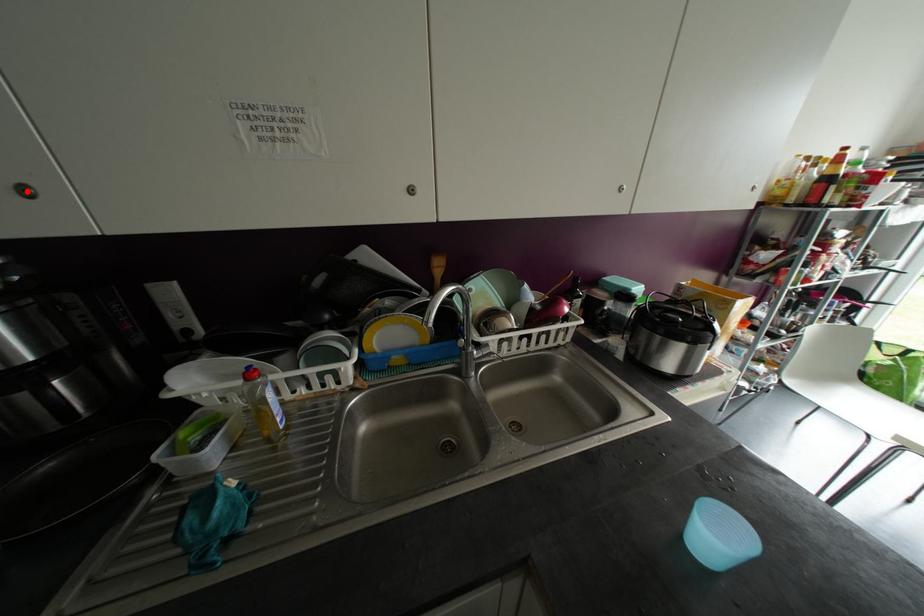
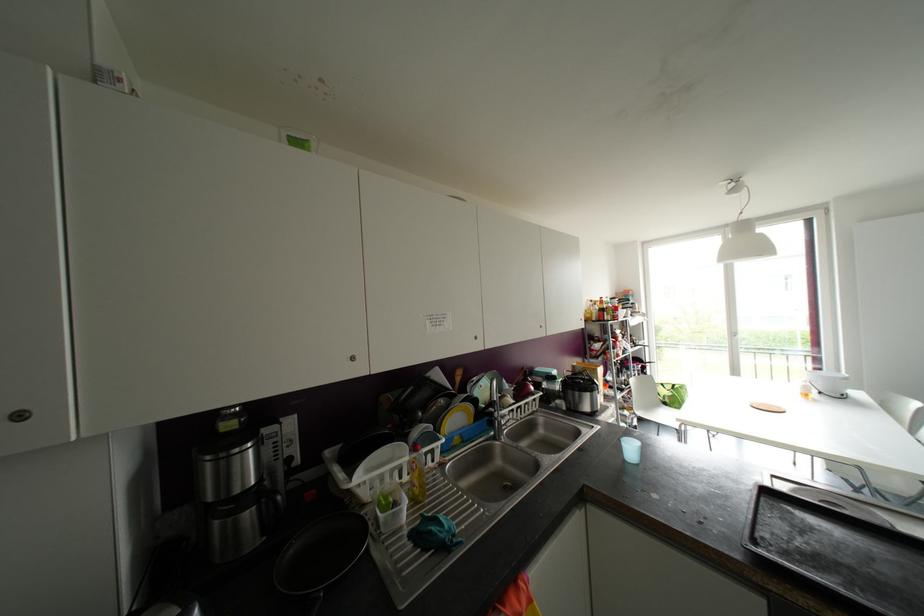
Question: I am providing you with two images of the same scene from different viewpoints. A red point is marked on the first image. Is the red point's position out of view in image 2?

Choices:
 (A) Yes
 (B) No

Answer: (B)